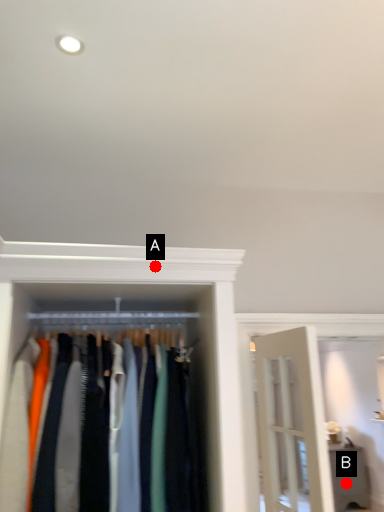
Question: Two points are circled on the image, labeled by A and B beside each circle. Which of the following is the farthest from the observer?

Choices:
 (A) A is further
 (B) B is further

Answer: (B)